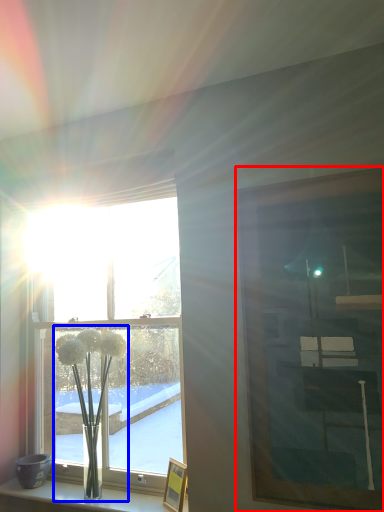
Question: Which object appears farthest to the camera in this image, picture frame (highlighted by a red box) or floral arrangement (highlighted by a blue box)?

Choices:
 (A) picture frame
 (B) floral arrangement

Answer: (B)